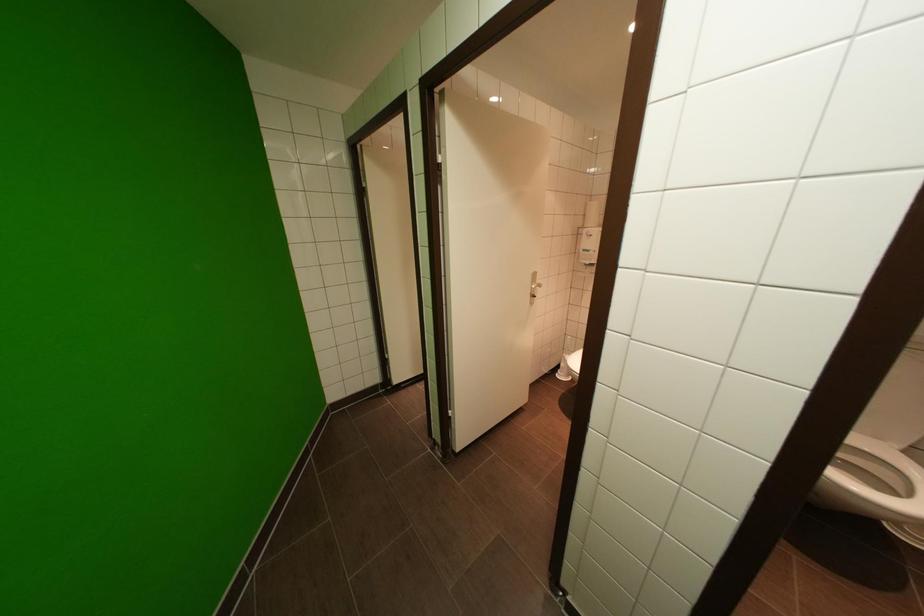
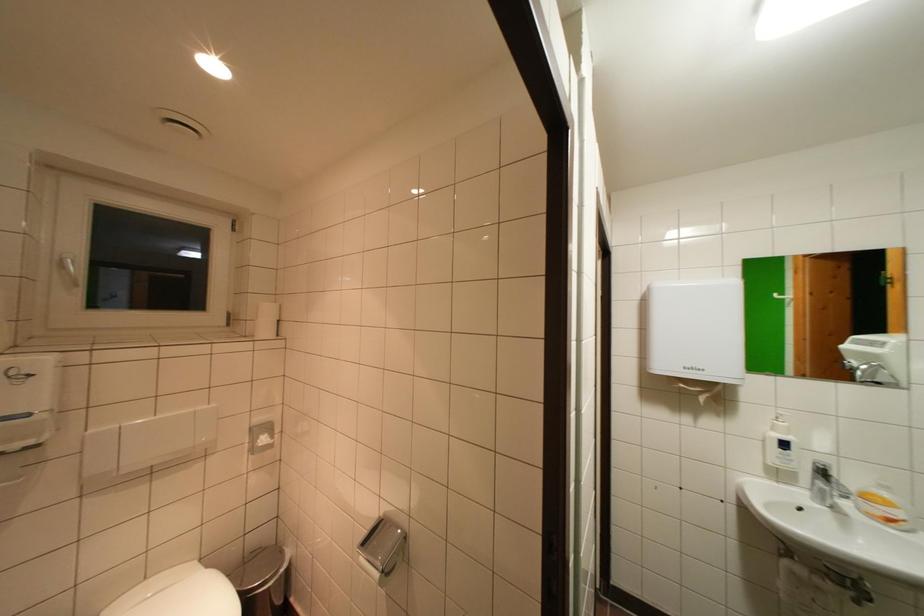
Question: The first image is from the beginning of the video and the second image is from the end. How did the camera likely rotate when shooting the video?

Choices:
 (A) Left
 (B) Right
 (C) Up
 (D) Down

Answer: (B)